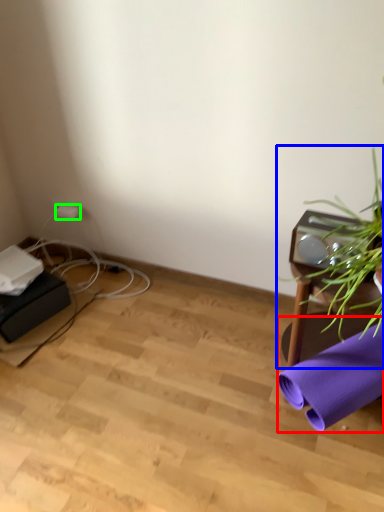
Question: Which object is the farthest from beach towel (highlighted by a red box)? Choose among these: houseplant (highlighted by a blue box) or plug (highlighted by a green box).

Choices:
 (A) houseplant
 (B) plug

Answer: (B)